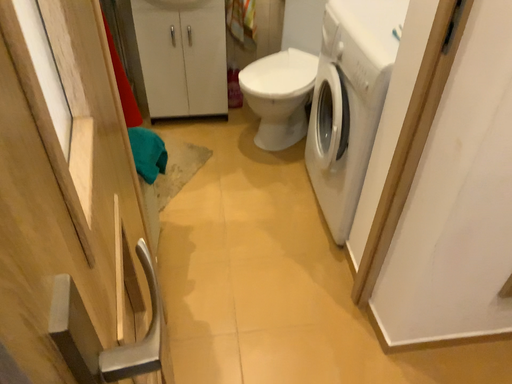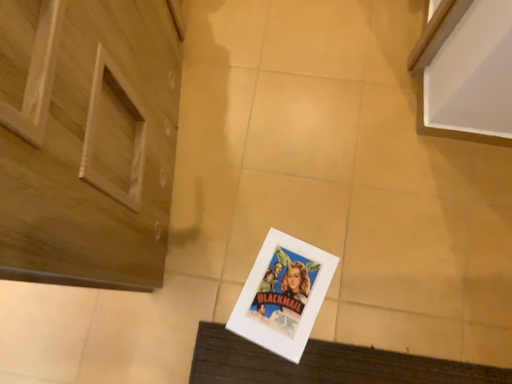
Question: How did the camera likely rotate when shooting the video?

Choices:
 (A) rotated downward
 (B) rotated upward

Answer: (A)